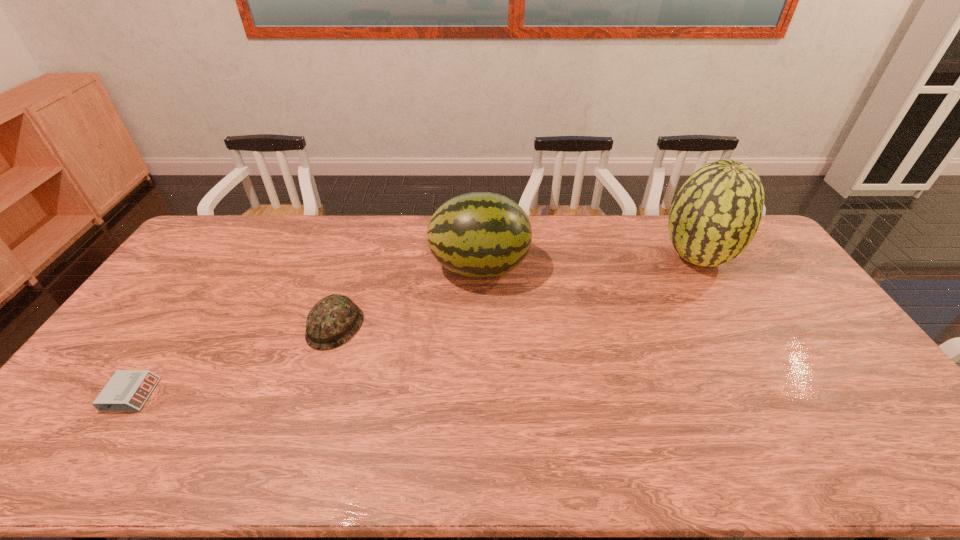
Where is `vacant area that lies between the left watermelon and the shortest object`? This screenshot has height=540, width=960. vacant area that lies between the left watermelon and the shortest object is located at coordinates (305, 331).

Where is `free space between the leftmost object and the second tallest object`? Image resolution: width=960 pixels, height=540 pixels. free space between the leftmost object and the second tallest object is located at coordinates (305, 331).

Locate an element on the screen. The image size is (960, 540). vacant space in between the shortest object and the second nearest object is located at coordinates (233, 361).

This screenshot has height=540, width=960. What are the coordinates of `unoccupied area between the second shortest object and the right watermelon` in the screenshot? It's located at (516, 292).

You are a GUI agent. You are given a task and a screenshot of the screen. Output one action in this format:
    pyautogui.click(x=<x>, y=<y>)
    Task: Click on the free space between the shortest object and the third tallest object
    This screenshot has height=540, width=960.
    Given the screenshot: What is the action you would take?
    pyautogui.click(x=233, y=361)

Find the location of a particular element. empty location between the third tallest object and the third object from left to right is located at coordinates (407, 297).

Identify the location of vacant point located between the leftmost object and the left watermelon. This screenshot has height=540, width=960. coord(305,331).

Where is `empty space that is in between the left watermelon and the headwear`? This screenshot has width=960, height=540. empty space that is in between the left watermelon and the headwear is located at coordinates (407, 297).

Locate an element on the screen. Image resolution: width=960 pixels, height=540 pixels. vacant area that lies between the taller watermelon and the second object from left to right is located at coordinates (516, 292).

The image size is (960, 540). In order to click on object that is the second closest one to the right watermelon in this screenshot , I will do `click(332, 321)`.